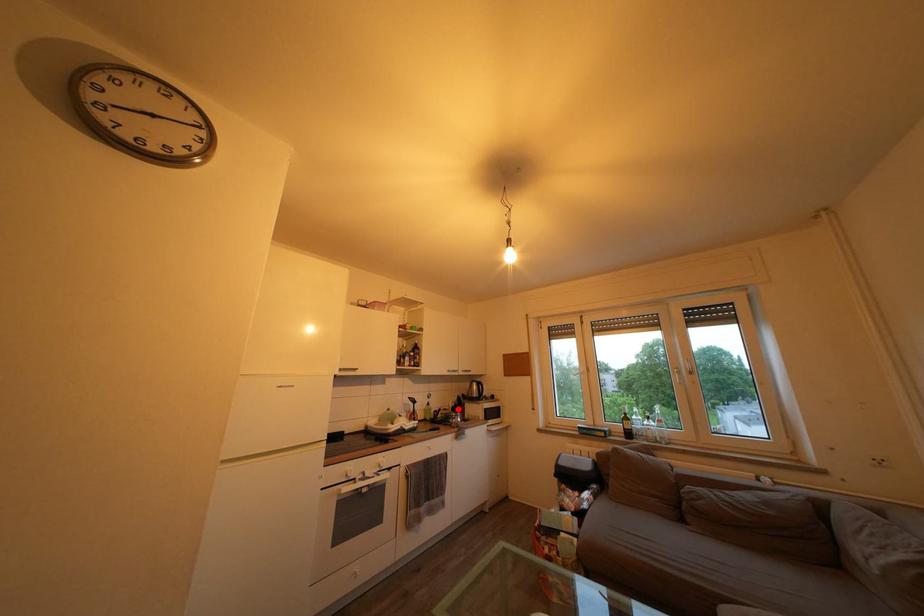
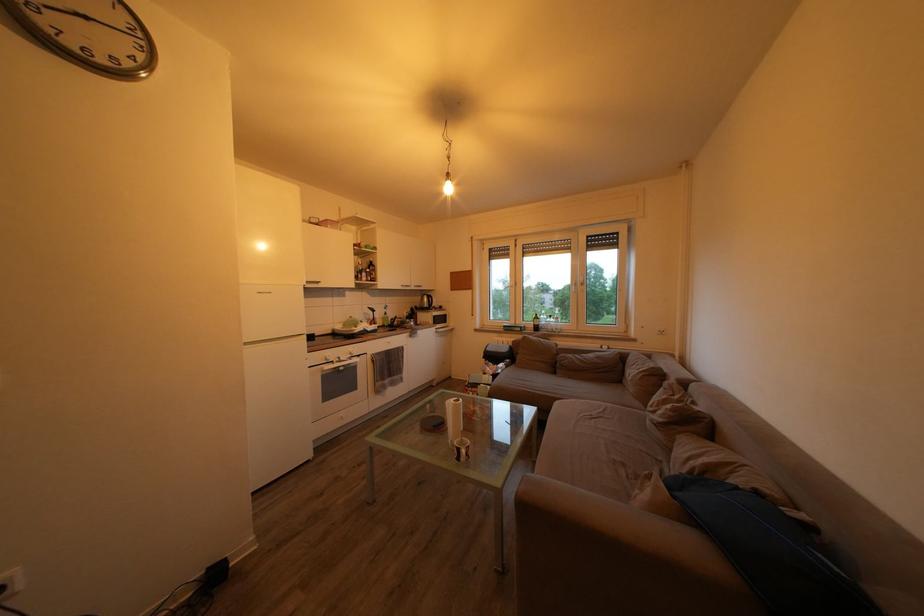
Question: I am providing you with two images of the same scene from different viewpoints. In image1, a red point is highlighted. Considering the same 3D point in image2, which of the following is correct?

Choices:
 (A) It is closer
 (B) It is farther

Answer: (A)